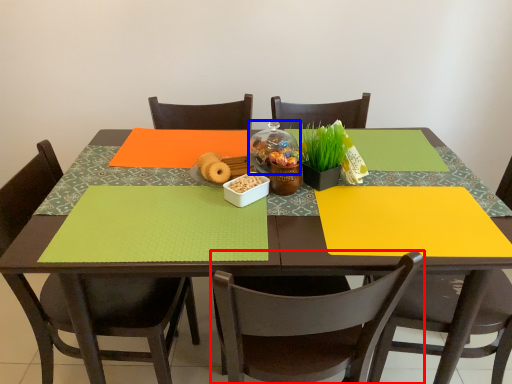
Question: Which object is further to the camera taking this photo, chair (highlighted by a red box) or glass jar (highlighted by a blue box)?

Choices:
 (A) chair
 (B) glass jar

Answer: (B)